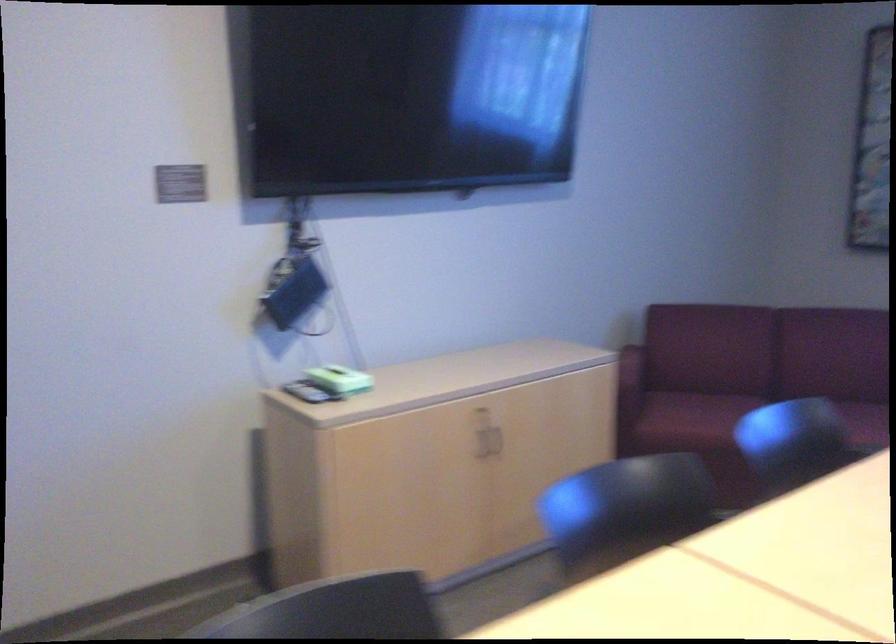
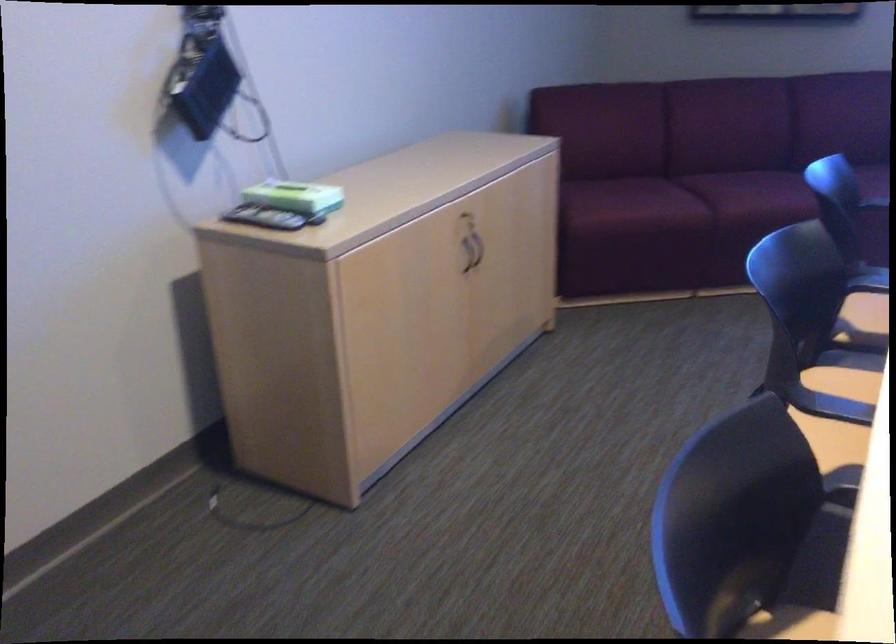
Question: The first image is from the beginning of the video and the second image is from the end. How did the camera likely rotate when shooting the video?

Choices:
 (A) Left
 (B) Right
 (C) Up
 (D) Down

Answer: (B)